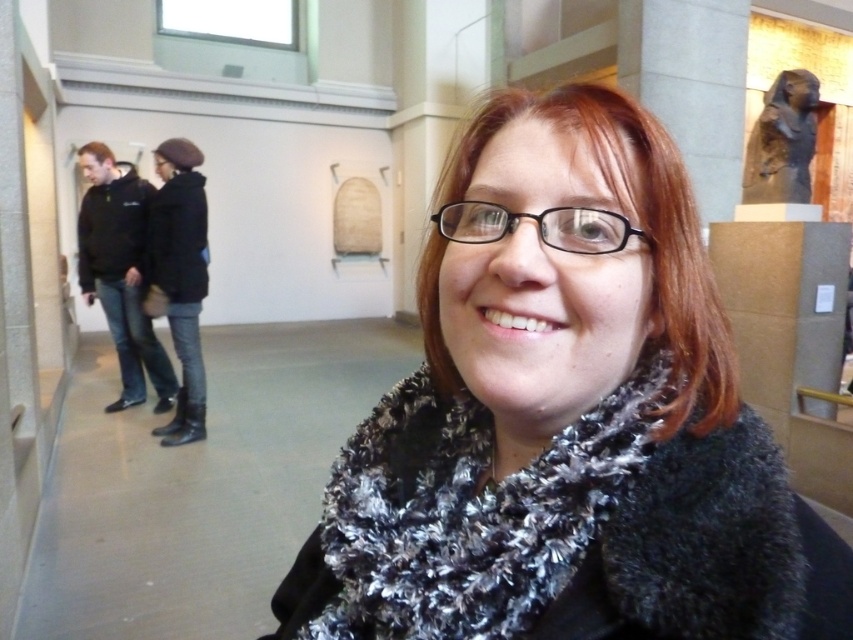
From the picture: You are a photographer trying to capture a clear shot of the black fuzzy scarf at center and the black hoodie at left. Since you want to focus on the scarf, which object should you adjust your camera to focus on first?

The black fuzzy scarf at center is below the black hoodie at left, so you should focus on the black fuzzy scarf at center first because it is closer to the camera.

You are planning to take a photo of the black fuzzy scarf at center and the black hoodie at left. Which of these two items has a smaller width?

The black fuzzy scarf at center has a smaller width than the black hoodie at left because it is thinner than the black hoodie at left.

You are standing in the museum and looking at the scene. There are two points marked in the image, point 1 at coordinates point (415, 374) and point 2 at coordinates point (347, 525). Which point is closer to you?

Point (415, 374) is closer to you than point (347, 525) because it is further to the viewer.